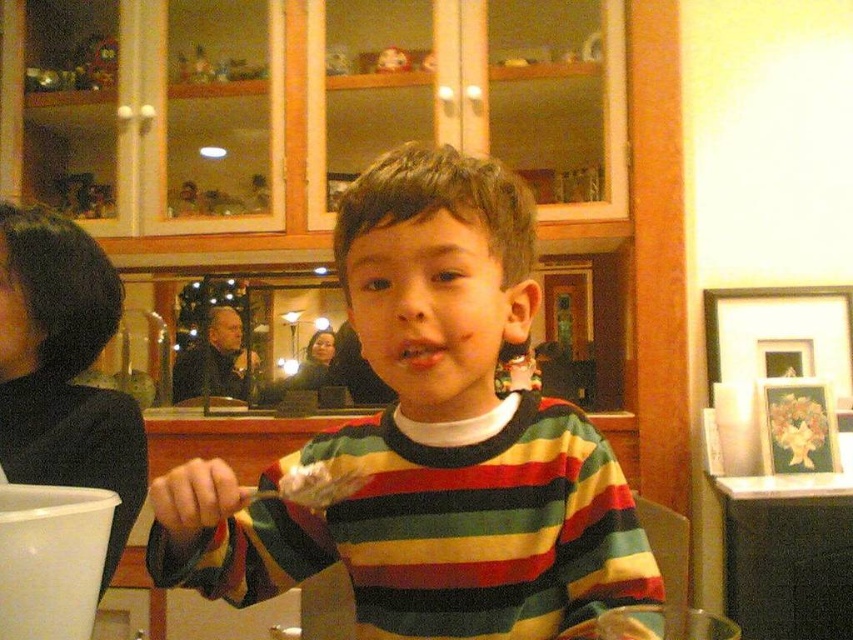
You are a photographer trying to capture the striped cotton shirt at center and the white creamy food at center in a single frame. Given that the shirt is larger than the food, how should you position your camera to ensure both are clearly visible?

Since the striped cotton shirt at center is larger than the white creamy food at center, position the camera closer to the white creamy food at center to balance their sizes in the frame.

In the scene shown: You are a food delivery person who needs to place a small container on the table where the striped cotton shirt at center and white creamy food at center are located. Can you fit the container between them without moving either object?

The striped cotton shirt at center is wider than the white creamy food at center. Since the shirt is wider, there might be enough space between them for the container, but the exact fit depends on their arrangement. However, based on the width comparison, it is possible to place the container between them without moving either object.

You are standing in the dining area and want to reach a point that is exactly at coordinates point (x=498, y=413). If your arm can extend 30 inches, can you reach that point without moving your feet?

The distance of point (x=498, y=413) from viewer is 28.98 inches, so yes, you can reach it since your arm can extend 30 inches which is longer than the distance.